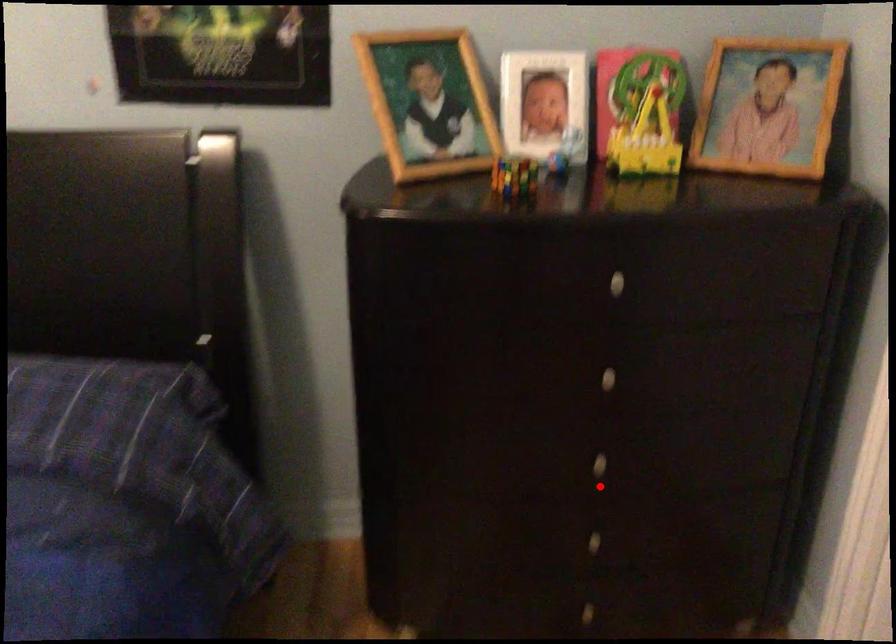
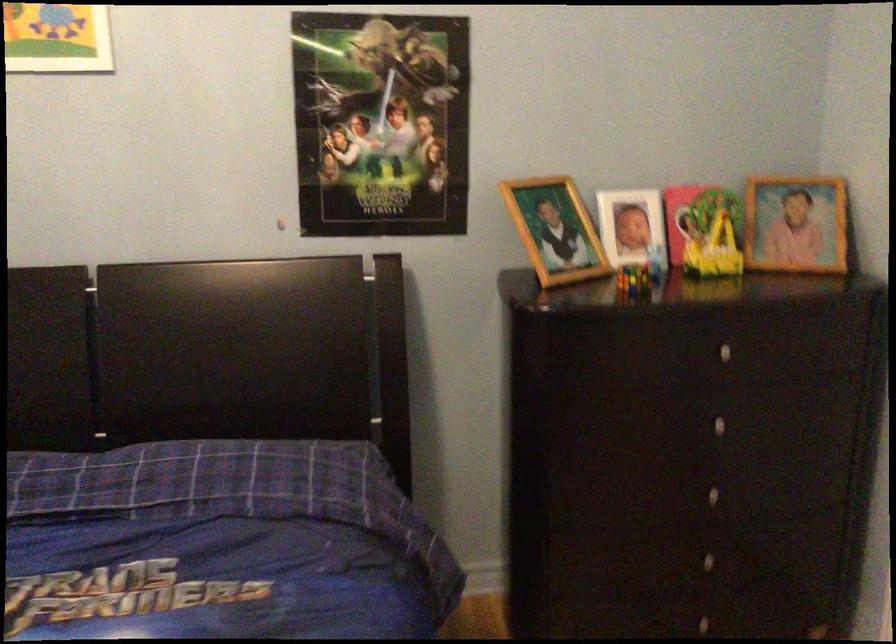
The point at the highlighted location is marked in the first image. Where is the corresponding point in the second image?

(711, 516)